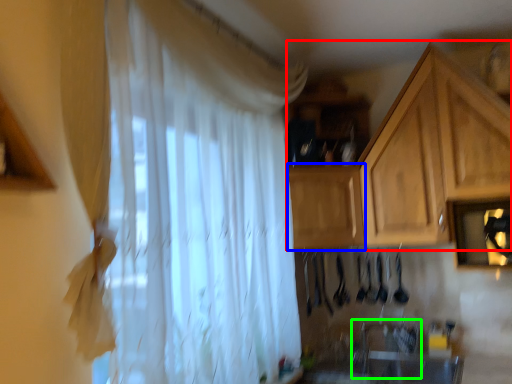
Question: Considering the real-world distances, which object is farthest from cabinetry (highlighted by a red box)? cabinetry (highlighted by a blue box) or sink (highlighted by a green box)?

Choices:
 (A) cabinetry
 (B) sink

Answer: (B)